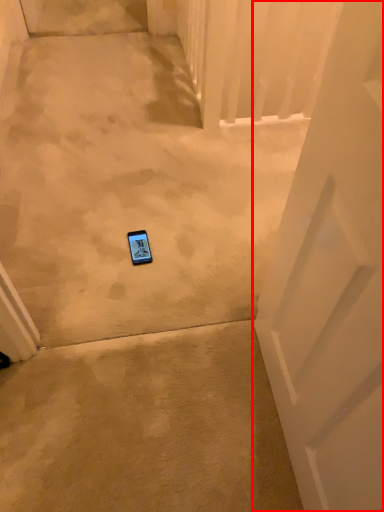
Question: From the image's perspective, considering the relative positions of door (annotated by the red box) and gadget in the image provided, where is door (annotated by the red box) located with respect to the staircase?

Choices:
 (A) below
 (B) above

Answer: (A)